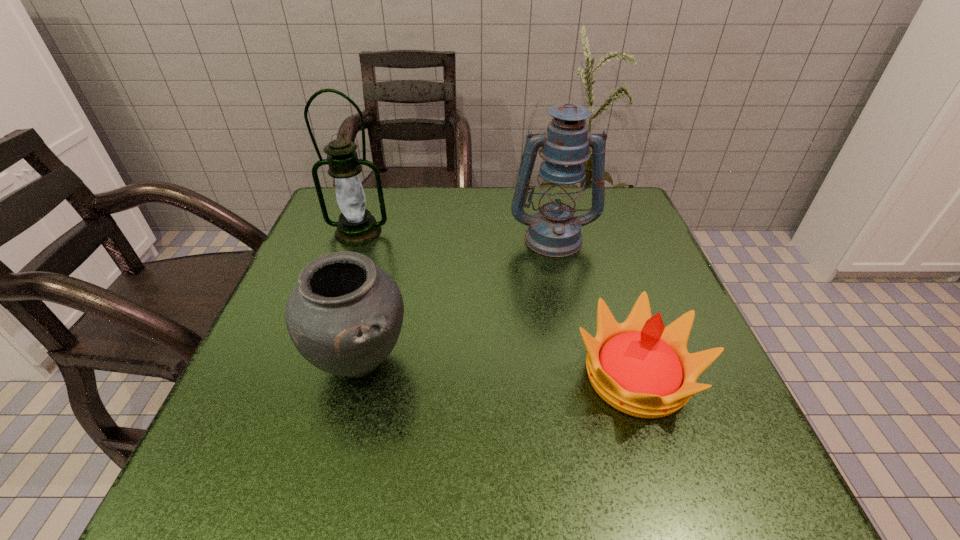
Locate an element on the screen. The image size is (960, 540). the closest object to the shortest object is located at coordinates (554, 231).

You are a GUI agent. You are given a task and a screenshot of the screen. Output one action in this format:
    pyautogui.click(x=<x>, y=<y>)
    Task: Click on the free region that satisfies the following two spatial constraints: 1. on the side where the left lantern emits light; 2. on the right side of the urn
    
    Given the screenshot: What is the action you would take?
    pyautogui.click(x=312, y=361)

Where is `vacant space that satisfies the following two spatial constraints: 1. on the side where the left lantern emits light; 2. on the right side of the urn`? vacant space that satisfies the following two spatial constraints: 1. on the side where the left lantern emits light; 2. on the right side of the urn is located at coordinates (312, 361).

At what (x,y) coordinates should I click in order to perform the action: click on free point that satisfies the following two spatial constraints: 1. on the side where the crown emits light; 2. on the right side of the left lantern. Please return your answer as a coordinate pair (x, y). The width and height of the screenshot is (960, 540). Looking at the image, I should click on (306, 376).

Where is `free space in the image that satisfies the following two spatial constraints: 1. on the side where the crown emits light; 2. on the left side of the left lantern`? free space in the image that satisfies the following two spatial constraints: 1. on the side where the crown emits light; 2. on the left side of the left lantern is located at coordinates (306, 376).

Identify the location of free space in the image that satisfies the following two spatial constraints: 1. on the side where the shortest object emits light; 2. on the right side of the left lantern. The image size is (960, 540). (306, 376).

Image resolution: width=960 pixels, height=540 pixels. I want to click on blank area in the image that satisfies the following two spatial constraints: 1. on the front-facing side of the right lantern; 2. on the left side of the shortest object, so click(583, 376).

Where is `free space that satisfies the following two spatial constraints: 1. on the side where the left lantern emits light; 2. on the right side of the second shortest object`? The height and width of the screenshot is (540, 960). free space that satisfies the following two spatial constraints: 1. on the side where the left lantern emits light; 2. on the right side of the second shortest object is located at coordinates (312, 361).